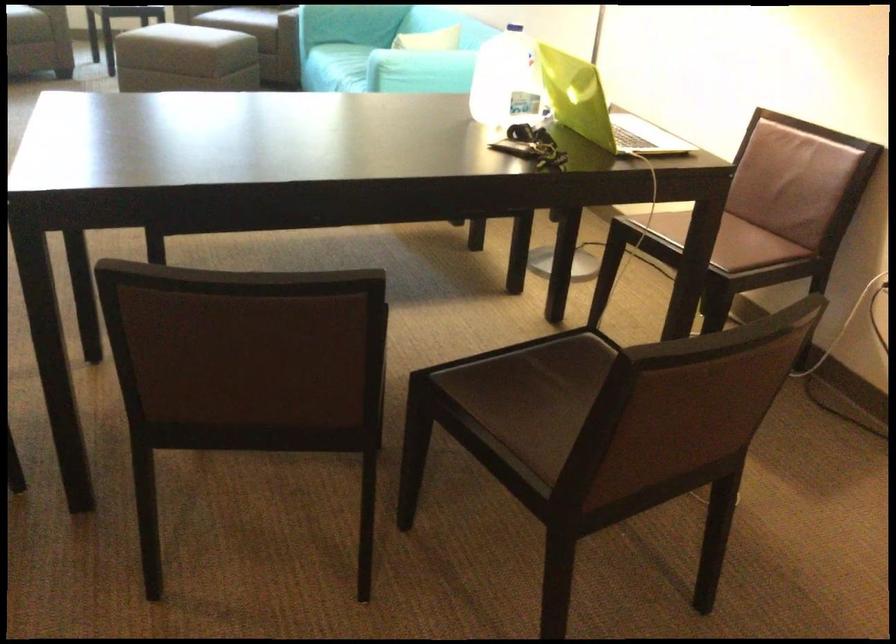
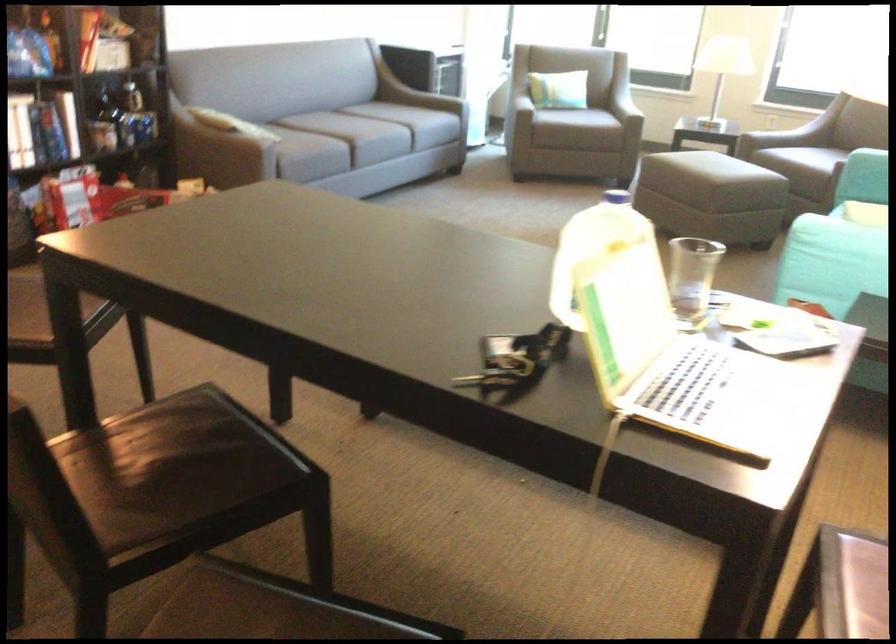
Question: In a continuous first-person perspective shot, in which direction is the camera moving?

Choices:
 (A) Left
 (B) Right
 (C) Forward
 (D) Backward

Answer: (D)